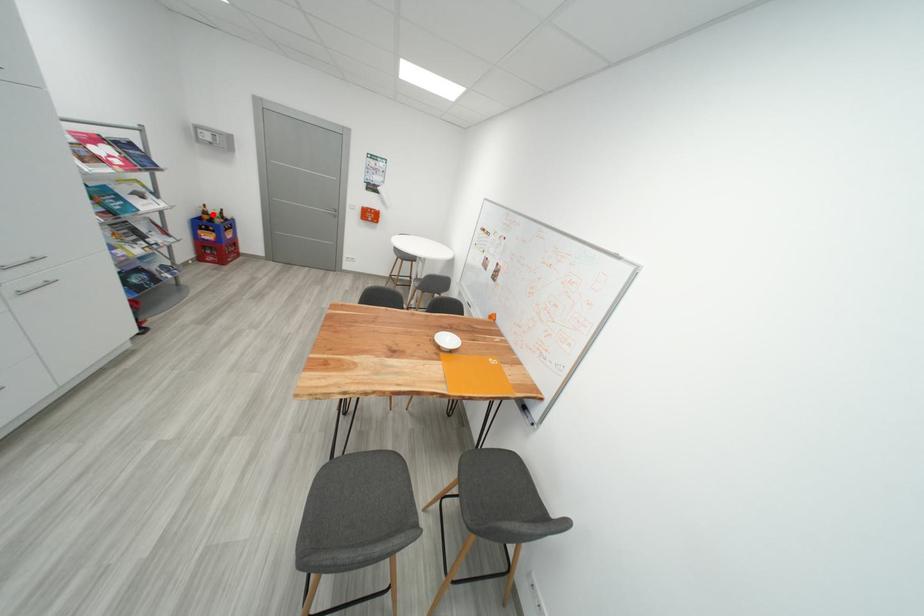
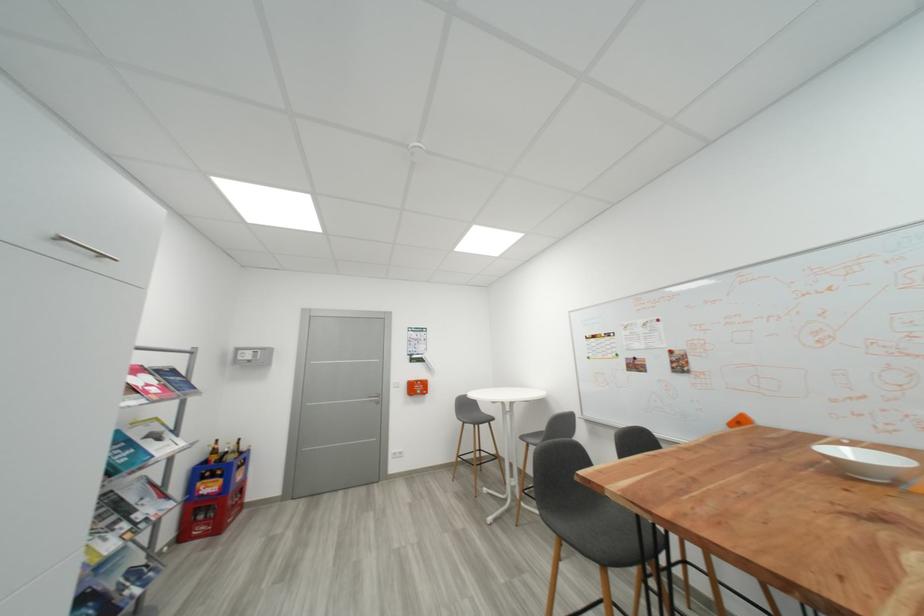
Question: I am providing you with two images of the same scene from different viewpoints. A red point is shown in image1. For the corresponding object point in image2, is it positioned nearer or farther from the camera?

Choices:
 (A) Nearer
 (B) Farther

Answer: (B)